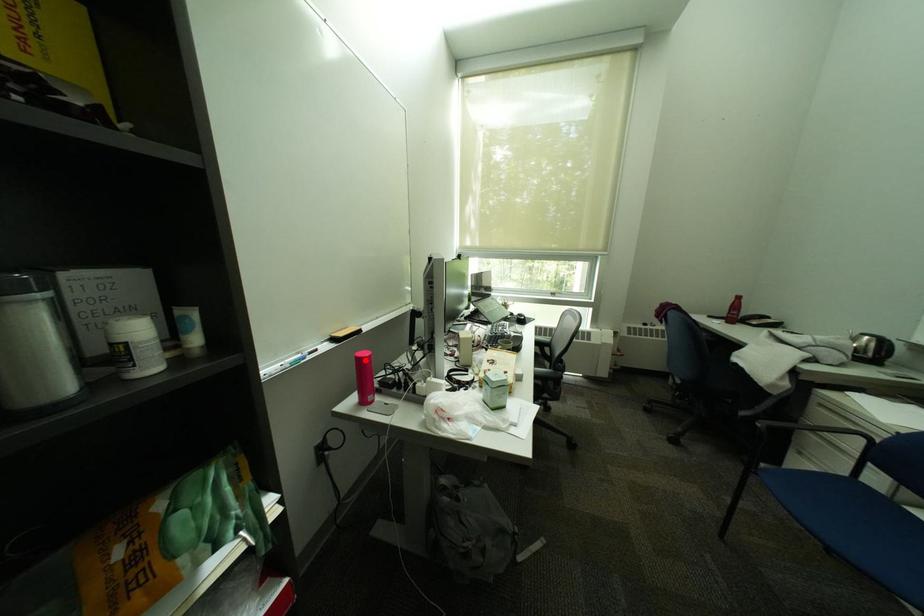
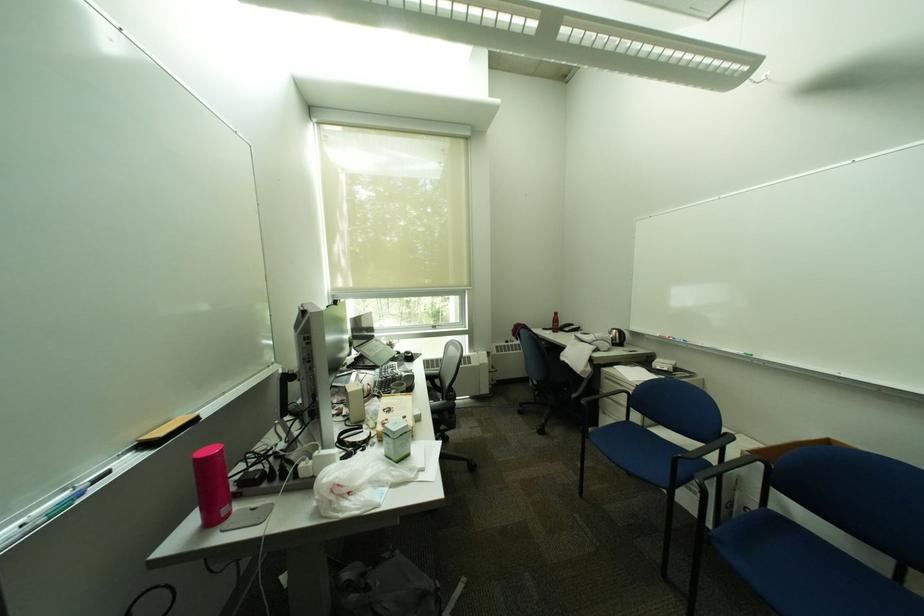
Question: I am providing you with two images of the same scene from different viewpoints. A red point is marked on the first image. At the location where the point appears in image 1, is it still visible in image 2?

Choices:
 (A) Yes
 (B) No

Answer: (A)